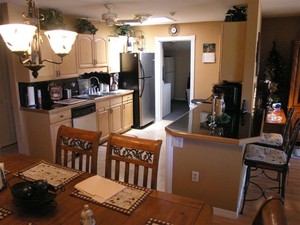
Identify the location of drawers. The height and width of the screenshot is (225, 300). (126, 97), (61, 115).